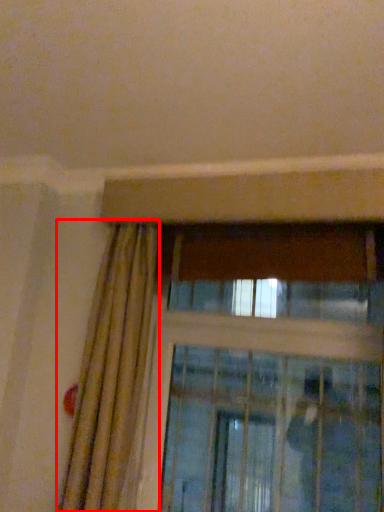
Question: From the image's perspective, where is curtain (annotated by the red box) located in relation to screen door in the image?

Choices:
 (A) above
 (B) below

Answer: (A)